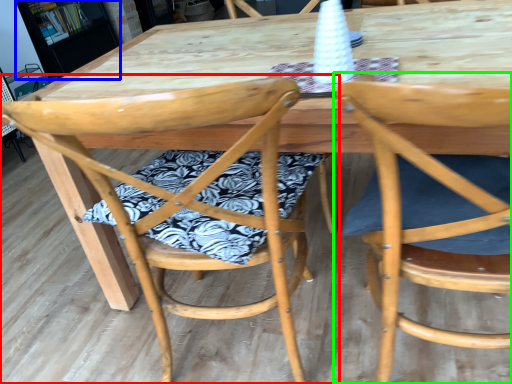
Question: Which is farther away from chair (highlighted by a red box)? bookshelf (highlighted by a blue box) or chair (highlighted by a green box)?

Choices:
 (A) bookshelf
 (B) chair

Answer: (A)